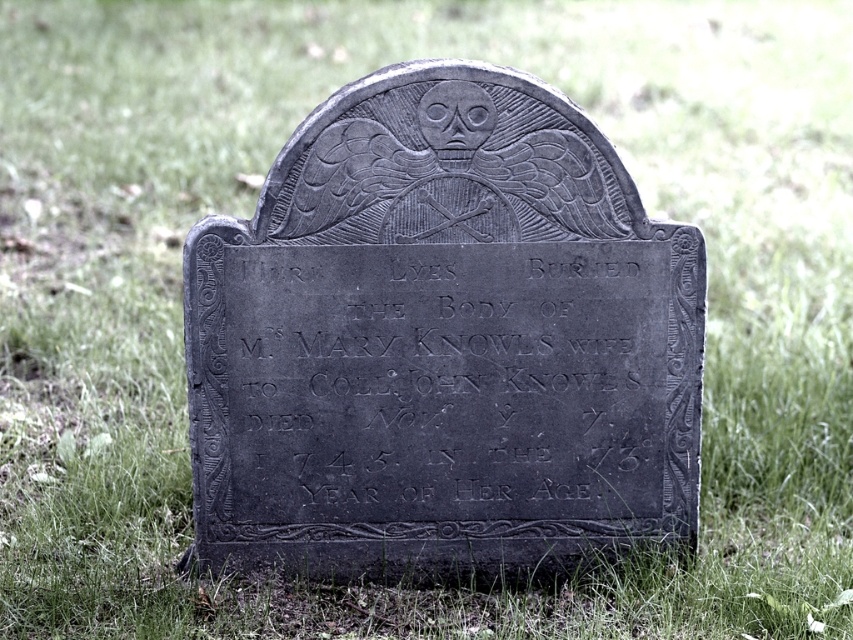
What is the relationship between the black stone gravestone at center and the black stone plaque at center in terms of their vertical positioning?

The black stone gravestone at center is located above the black stone plaque at center.

What is the relationship between the size of the black stone gravestone at center and the black stone plaque at center?

The black stone gravestone at center is larger in size than the black stone plaque at center.